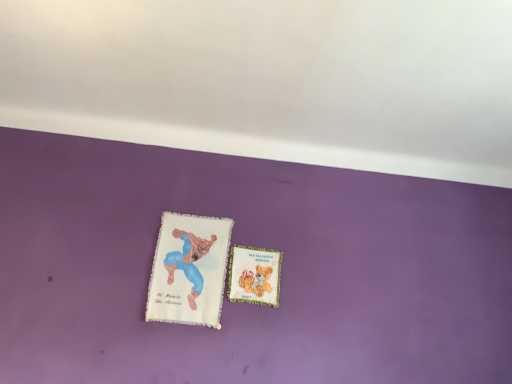
Question: Based on their sizes in the image, would you say white fabric book at center, the second paperback book viewed from the right, is bigger or smaller than pastel green fabric bookmark at center, marked as the 1th paperback book in a right-to-left arrangement?

Choices:
 (A) small
 (B) big

Answer: (B)

Question: Is white fabric book at center, the second paperback book viewed from the right, taller or shorter than pastel green fabric bookmark at center, marked as the 1th paperback book in a right-to-left arrangement?

Choices:
 (A) tall
 (B) short

Answer: (A)

Question: Is white fabric book at center, the 1th paperback book in the left-to-right sequence, spatially inside pastel green fabric bookmark at center, which is counted as the 2th paperback book, starting from the left, or outside of it?

Choices:
 (A) inside
 (B) outside

Answer: (B)

Question: Considering their positions, is pastel green fabric bookmark at center, which is counted as the 2th paperback book, starting from the left, located in front of or behind white fabric book at center, the second paperback book viewed from the right?

Choices:
 (A) behind
 (B) front

Answer: (A)

Question: Is point (246, 294) closer or farther from the camera than point (158, 273)?

Choices:
 (A) farther
 (B) closer

Answer: (A)

Question: Considering the relative positions of pastel green fabric bookmark at center, marked as the 1th paperback book in a right-to-left arrangement, and white fabric book at center, the second paperback book viewed from the right, in the image provided, is pastel green fabric bookmark at center, marked as the 1th paperback book in a right-to-left arrangement, to the left or to the right of white fabric book at center, the second paperback book viewed from the right,?

Choices:
 (A) left
 (B) right

Answer: (B)

Question: From a real-world perspective, is pastel green fabric bookmark at center, which is counted as the 2th paperback book, starting from the left, above or below white fabric book at center, the 1th paperback book in the left-to-right sequence?

Choices:
 (A) above
 (B) below

Answer: (A)